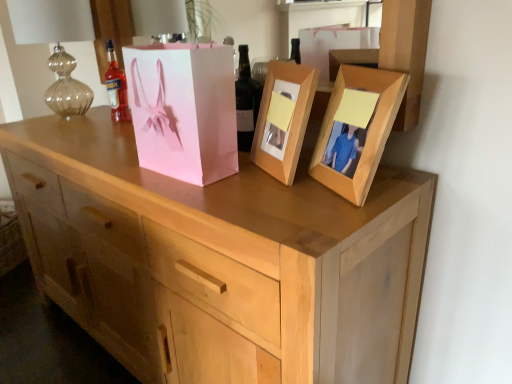
What do you see at coordinates (116, 87) in the screenshot? The width and height of the screenshot is (512, 384). I see `translucent glass bottle at upper left, the 1th bottle positioned from the back` at bounding box center [116, 87].

This screenshot has width=512, height=384. What do you see at coordinates (184, 110) in the screenshot?
I see `pink paper bag at center` at bounding box center [184, 110].

This screenshot has height=384, width=512. What are the coordinates of `dark brown glass bottle at center, marked as the second bottle in a back-to-front arrangement` in the screenshot? It's located at (246, 101).

Does wooden photo frame at center, which is the 1th picture frame from left to right, have a larger size compared to dark brown glass bottle at center, acting as the 1th bottle starting from the front?

Correct, wooden photo frame at center, which is the 1th picture frame from left to right, is larger in size than dark brown glass bottle at center, acting as the 1th bottle starting from the front.

From the image's perspective, count 1st picture frames downward from the dark brown glass bottle at center, marked as the second bottle in a back-to-front arrangement, and point to it. Please provide its 2D coordinates.

[(283, 118)]

Which object is further away from the camera, wooden photo frame at center, the second picture frame viewed from the right, or dark brown glass bottle at center, the 1th bottle positioned from the right?

Positioned behind is dark brown glass bottle at center, the 1th bottle positioned from the right.

From a real-world perspective, which is physically above, wooden photo frame at center, which is the 1th picture frame from left to right, or dark brown glass bottle at center, marked as the second bottle in a back-to-front arrangement?

dark brown glass bottle at center, marked as the second bottle in a back-to-front arrangement.

Locate an element on the screen. The image size is (512, 384). chest of drawers on the left of pink paper bag at center is located at coordinates (219, 260).

Considering the positions of objects light wood chest of drawers at center and pink paper bag at center in the image provided, who is in front, light wood chest of drawers at center or pink paper bag at center?

light wood chest of drawers at center is closer to the camera.

Can you confirm if light wood chest of drawers at center is positioned to the right of pink paper bag at center?

No.

Is light wood chest of drawers at center positioned with its back to pink paper bag at center?

No, light wood chest of drawers at center is not facing away from pink paper bag at center.

Is wooden photo frame at upper right, acting as the 1th picture frame starting from the right, positioned far away from wooden photo frame at center, the second picture frame viewed from the right?

No, wooden photo frame at upper right, acting as the 1th picture frame starting from the right, is in close proximity to wooden photo frame at center, the second picture frame viewed from the right.

Which object is positioned more to the left, wooden photo frame at upper right, acting as the 1th picture frame starting from the right, or wooden photo frame at center, the second picture frame viewed from the right?

Positioned to the left is wooden photo frame at center, the second picture frame viewed from the right.

Is wooden photo frame at center, which is the 1th picture frame from left to right, surrounded by wooden photo frame at upper right, which is the second picture frame from left to right?

Actually, wooden photo frame at center, which is the 1th picture frame from left to right, is outside wooden photo frame at upper right, which is the second picture frame from left to right.

Is point (357, 83) closer or farther from the camera than point (311, 91)?

Clearly, point (357, 83) is closer to the camera than point (311, 91).

How distant is pink paper bag at center from translucent glass bottle at upper left, acting as the 2th bottle starting from the right?

pink paper bag at center and translucent glass bottle at upper left, acting as the 2th bottle starting from the right, are 18.93 inches apart from each other.

Is pink paper bag at center positioned before translucent glass bottle at upper left, the 1th bottle positioned from the back?

That is True.

Which of these two, pink paper bag at center or translucent glass bottle at upper left, which is counted as the first bottle, starting from the left, stands shorter?

With less height is translucent glass bottle at upper left, which is counted as the first bottle, starting from the left.

From the image's perspective, between pink paper bag at center and translucent glass bottle at upper left, acting as the 2th bottle starting from the right, which one is located above?

translucent glass bottle at upper left, acting as the 2th bottle starting from the right.

Is pink paper bag at center at the right side of light wood chest of drawers at center?

Yes, pink paper bag at center is to the right of light wood chest of drawers at center.

Who is shorter, pink paper bag at center or light wood chest of drawers at center?

pink paper bag at center is shorter.

Does light wood chest of drawers at center have a greater height compared to dark brown glass bottle at center, the 2th bottle when ordered from left to right?

Yes.

This screenshot has height=384, width=512. I want to click on chest of drawers on the left of dark brown glass bottle at center, the 2th bottle when ordered from left to right, so click(x=219, y=260).

Between light wood chest of drawers at center and dark brown glass bottle at center, acting as the 1th bottle starting from the front, which one has smaller width?

dark brown glass bottle at center, acting as the 1th bottle starting from the front, is thinner.

Between light wood chest of drawers at center and dark brown glass bottle at center, acting as the 1th bottle starting from the front, which one appears on the left side from the viewer's perspective?

light wood chest of drawers at center.

Is there a large distance between wooden photo frame at center, which is the 1th picture frame from left to right, and translucent glass bottle at upper left, acting as the 2th bottle starting from the right?

Actually, wooden photo frame at center, which is the 1th picture frame from left to right, and translucent glass bottle at upper left, acting as the 2th bottle starting from the right, are a little close together.

Between wooden photo frame at center, which is the 1th picture frame from left to right, and translucent glass bottle at upper left, which is counted as the first bottle, starting from the left, which one is positioned in front?

wooden photo frame at center, which is the 1th picture frame from left to right, is in front.

Could translucent glass bottle at upper left, which is counted as the first bottle, starting from the left, be considered to be inside wooden photo frame at center, the second picture frame viewed from the right?

No, translucent glass bottle at upper left, which is counted as the first bottle, starting from the left, is not surrounded by wooden photo frame at center, the second picture frame viewed from the right.

At what (x,y) coordinates should I click in order to perform the action: click on bottle that is the 2nd object above the wooden photo frame at center, which is the 1th picture frame from left to right (from a real-world perspective). Please return your answer as a coordinate pair (x, y). Looking at the image, I should click on (246, 101).

The image size is (512, 384). Identify the location of the chest of drawers in front of the pink paper bag at center. (219, 260).

From the image, which object appears to be nearer to pink paper bag at center, dark brown glass bottle at center, the 2th bottle when ordered from left to right, or wooden photo frame at center, the second picture frame viewed from the right?

dark brown glass bottle at center, the 2th bottle when ordered from left to right.

From the image, which object appears to be nearer to translucent glass bottle at upper left, the 1th bottle positioned from the back, wooden photo frame at center, which is the 1th picture frame from left to right, or wooden photo frame at upper right, which is the second picture frame from left to right?

wooden photo frame at center, which is the 1th picture frame from left to right, lies closer to translucent glass bottle at upper left, the 1th bottle positioned from the back, than the other object.

Based on the photo, based on their spatial positions, is dark brown glass bottle at center, the 2th bottle when ordered from left to right, or pink paper bag at center closer to light wood chest of drawers at center?

The object closer to light wood chest of drawers at center is pink paper bag at center.

Which object lies further to the anchor point translucent glass bottle at upper left, the 1th bottle positioned from the back, light wood chest of drawers at center or wooden photo frame at upper right, which is the second picture frame from left to right?

wooden photo frame at upper right, which is the second picture frame from left to right, is further to translucent glass bottle at upper left, the 1th bottle positioned from the back.

When comparing their distances from pink paper bag at center, does light wood chest of drawers at center or translucent glass bottle at upper left, the 1th bottle positioned from the back, seem closer?

Based on the image, light wood chest of drawers at center appears to be nearer to pink paper bag at center.

Based on their spatial positions, is light wood chest of drawers at center or translucent glass bottle at upper left, acting as the 2th bottle starting from the right, further from wooden photo frame at upper right, acting as the 1th picture frame starting from the right?

translucent glass bottle at upper left, acting as the 2th bottle starting from the right, is further to wooden photo frame at upper right, acting as the 1th picture frame starting from the right.

Looking at the image, which one is located further to light wood chest of drawers at center, wooden photo frame at upper right, acting as the 1th picture frame starting from the right, or pink paper bag at center?

The object further to light wood chest of drawers at center is wooden photo frame at upper right, acting as the 1th picture frame starting from the right.

Which object lies further to the anchor point pink paper bag at center, translucent glass bottle at upper left, which is the second bottle from front to back, or wooden photo frame at center, which is the 1th picture frame from left to right?

translucent glass bottle at upper left, which is the second bottle from front to back, is positioned further to the anchor pink paper bag at center.

Where is `picture frame between light wood chest of drawers at center and wooden photo frame at upper right, acting as the 1th picture frame starting from the right, from left to right`? picture frame between light wood chest of drawers at center and wooden photo frame at upper right, acting as the 1th picture frame starting from the right, from left to right is located at coordinates (283, 118).

The height and width of the screenshot is (384, 512). I want to click on cardboard box positioned between light wood chest of drawers at center and translucent glass bottle at upper left, which is the second bottle from front to back, from near to far, so click(184, 110).

Find the location of a particular element. bottle located between pink paper bag at center and wooden photo frame at upper right, which is the second picture frame from left to right, in the left-right direction is located at coordinates (246, 101).

You are a GUI agent. You are given a task and a screenshot of the screen. Output one action in this format:
    pyautogui.click(x=<x>, y=<y>)
    Task: Click on the picture frame between translucent glass bottle at upper left, acting as the 2th bottle starting from the right, and wooden photo frame at upper right, acting as the 1th picture frame starting from the right, from left to right
    The image size is (512, 384).
    Given the screenshot: What is the action you would take?
    click(283, 118)